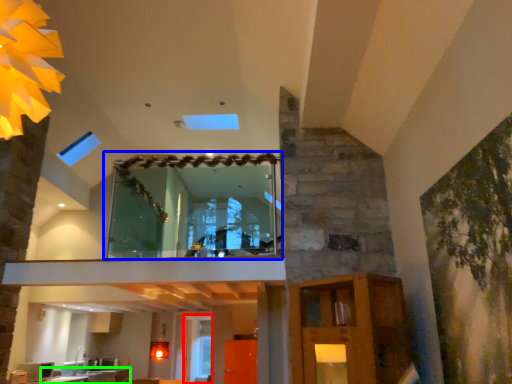
Question: Which object is the farthest from glass door (highlighted by a red box)? Choose among these: window (highlighted by a blue box) or counter top (highlighted by a green box).

Choices:
 (A) window
 (B) counter top

Answer: (A)